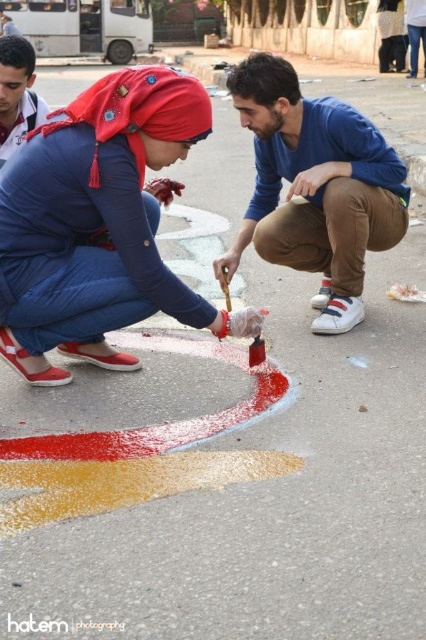
You are organizing a clothing donation drive and need to determine which items can fit into a storage box that has a width capacity of 40 cm. You have two shirts available for donation, the blue cotton shirt at center and the smooth blue shirt at upper left. Based on their sizes, which shirt is more likely to exceed the box width limit?

The blue cotton shirt at center has a larger width than the smooth blue shirt at upper left, so it is more likely to exceed the box width limit of 40 cm.

You are standing in front of the two people painting on the ground. You want to place a stool between the two points, point (388, 244) and point (3, 52). Which point should the stool be closer to so it is nearer to the person on the left?

The stool should be placed closer to point (388, 244) because it is closer to the viewer than point (3, 52), making it nearer to the person on the left.

You are an art instructor observing two students working on a collaborative painting project. You notice the matte red paintbrush at center and the wooden handle paint brush at center. Which brush is taller?

The matte red paintbrush at center is taller than the wooden handle paint brush at center.